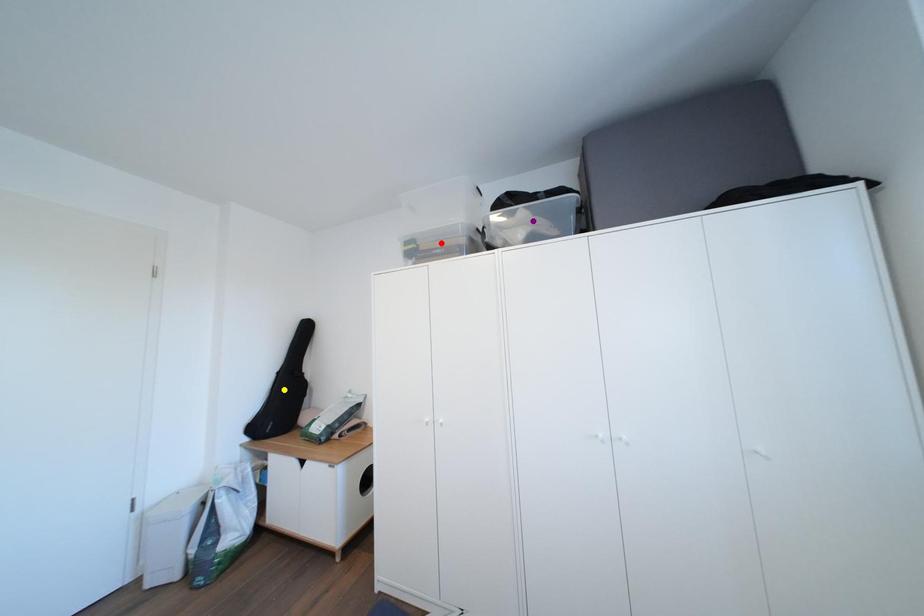
Order these from nearest to farthest:
purple point, red point, yellow point

purple point < red point < yellow point